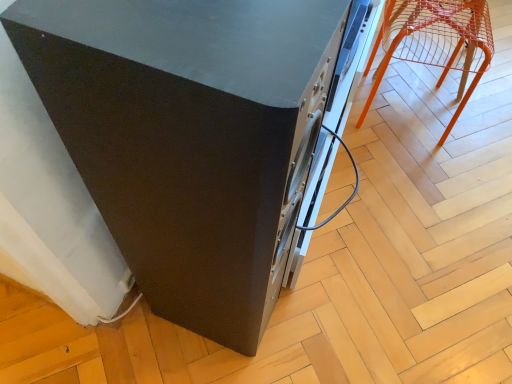
I want to click on orange wire mesh chair at upper right, so click(435, 42).

This screenshot has width=512, height=384. What do you see at coordinates (435, 42) in the screenshot?
I see `orange wire mesh chair at upper right` at bounding box center [435, 42].

This screenshot has width=512, height=384. In order to click on matte black speaker at center in this screenshot , I will do `click(199, 136)`.

The width and height of the screenshot is (512, 384). Describe the element at coordinates (199, 136) in the screenshot. I see `matte black speaker at center` at that location.

You are a GUI agent. You are given a task and a screenshot of the screen. Output one action in this format:
    pyautogui.click(x=<x>, y=<y>)
    Task: Click on the orange wire mesh chair at upper right
    
    Given the screenshot: What is the action you would take?
    pyautogui.click(x=435, y=42)

Which is more to the right, orange wire mesh chair at upper right or matte black speaker at center?

orange wire mesh chair at upper right.

Considering the relative positions of orange wire mesh chair at upper right and matte black speaker at center in the image provided, is orange wire mesh chair at upper right in front of matte black speaker at center?

No, orange wire mesh chair at upper right is further to the viewer.

Which point is more forward, (x=485, y=5) or (x=340, y=47)?

Positioned in front is point (x=340, y=47).

From the image's perspective, which object appears higher, orange wire mesh chair at upper right or matte black speaker at center?

orange wire mesh chair at upper right.

From a real-world perspective, who is located lower, orange wire mesh chair at upper right or matte black speaker at center?

orange wire mesh chair at upper right.

Considering the sizes of objects orange wire mesh chair at upper right and matte black speaker at center in the image provided, who is thinner, orange wire mesh chair at upper right or matte black speaker at center?

Thinner between the two is orange wire mesh chair at upper right.

In terms of height, does orange wire mesh chair at upper right look taller or shorter compared to matte black speaker at center?

Considering their sizes, orange wire mesh chair at upper right has less height than matte black speaker at center.

Is orange wire mesh chair at upper right smaller than matte black speaker at center?

Yes.

Is orange wire mesh chair at upper right completely or partially outside of matte black speaker at center?

Absolutely, orange wire mesh chair at upper right is external to matte black speaker at center.

Is orange wire mesh chair at upper right far away from matte black speaker at center?

No.

Could you tell me if orange wire mesh chair at upper right is turned towards matte black speaker at center?

No, orange wire mesh chair at upper right is not oriented towards matte black speaker at center.

This screenshot has height=384, width=512. I want to click on furniture that is above the matte black speaker at center (from the image's perspective), so click(435, 42).

Considering the relative positions of matte black speaker at center and orange wire mesh chair at upper right in the image provided, is matte black speaker at center to the right of orange wire mesh chair at upper right from the viewer's perspective?

Incorrect, matte black speaker at center is not on the right side of orange wire mesh chair at upper right.

Is matte black speaker at center positioned in front of orange wire mesh chair at upper right?

Yes, matte black speaker at center is closer to the camera.

Which point is more distant from viewer, (240, 328) or (451, 51)?

Positioned behind is point (451, 51).

From the image's perspective, does matte black speaker at center appear higher than orange wire mesh chair at upper right?

Incorrect, from the image's perspective, matte black speaker at center is lower than orange wire mesh chair at upper right.

From a real-world perspective, which object rests below the other?

orange wire mesh chair at upper right is physically lower.

Consider the image. Is matte black speaker at center wider than orange wire mesh chair at upper right?

Correct, the width of matte black speaker at center exceeds that of orange wire mesh chair at upper right.

Consider the image. In terms of height, does matte black speaker at center look taller or shorter compared to orange wire mesh chair at upper right?

matte black speaker at center is taller than orange wire mesh chair at upper right.

Considering the relative sizes of matte black speaker at center and orange wire mesh chair at upper right in the image provided, is matte black speaker at center bigger than orange wire mesh chair at upper right?

Yes, matte black speaker at center is bigger than orange wire mesh chair at upper right.

Is matte black speaker at center completely or partially outside of orange wire mesh chair at upper right?

Indeed, matte black speaker at center is completely outside orange wire mesh chair at upper right.

Is there a large distance between matte black speaker at center and orange wire mesh chair at upper right?

They are positioned close to each other.

Is matte black speaker at center positioned with its back to orange wire mesh chair at upper right?

No, orange wire mesh chair at upper right is not at the back of matte black speaker at center.

Can you tell me how much matte black speaker at center and orange wire mesh chair at upper right differ in facing direction?

matte black speaker at center and orange wire mesh chair at upper right are facing 10.9 degrees away from each other.

Where is `home appliance below the orange wire mesh chair at upper right (from the image's perspective)`? home appliance below the orange wire mesh chair at upper right (from the image's perspective) is located at coordinates (199, 136).

You are a GUI agent. You are given a task and a screenshot of the screen. Output one action in this format:
    pyautogui.click(x=<x>, y=<y>)
    Task: Click on the home appliance below the orange wire mesh chair at upper right (from the image's perspective)
    The image size is (512, 384).
    Given the screenshot: What is the action you would take?
    pyautogui.click(x=199, y=136)

Image resolution: width=512 pixels, height=384 pixels. Find the location of `home appliance above the orange wire mesh chair at upper right (from a real-world perspective)`. home appliance above the orange wire mesh chair at upper right (from a real-world perspective) is located at coordinates (199, 136).